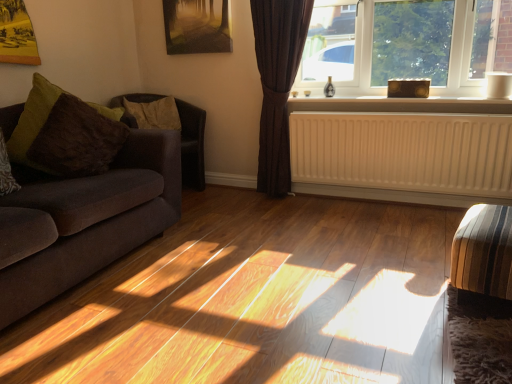
The width and height of the screenshot is (512, 384). In order to click on wooden floor at center in this screenshot , I will do (256, 300).

Is wooden textured picture frame at upper center not inside matte brown window at upper right?

Indeed, wooden textured picture frame at upper center is completely outside matte brown window at upper right.

Can you see wooden textured picture frame at upper center touching matte brown window at upper right?

No, wooden textured picture frame at upper center is not touching matte brown window at upper right.

Is wooden textured picture frame at upper center turned away from matte brown window at upper right?

No.

Is the depth of wooden textured picture frame at upper center greater than that of brown textured curtain at upper right?

Yes, wooden textured picture frame at upper center is further from the camera.

Where is `curtain lying below the wooden textured picture frame at upper center (from the image's perspective)`? This screenshot has height=384, width=512. curtain lying below the wooden textured picture frame at upper center (from the image's perspective) is located at coordinates (277, 83).

Looking at their sizes, would you say wooden textured picture frame at upper center is wider or thinner than brown textured curtain at upper right?

Clearly, wooden textured picture frame at upper center has less width compared to brown textured curtain at upper right.

Considering the sizes of objects striped fabric armchair at lower right, the second armchair from the back, and white painted wood at upper center in the image provided, who is smaller, striped fabric armchair at lower right, the second armchair from the back, or white painted wood at upper center?

white painted wood at upper center is smaller.

Is striped fabric armchair at lower right, the 1th armchair positioned from the front, far away from white painted wood at upper center?

Yes, striped fabric armchair at lower right, the 1th armchair positioned from the front, and white painted wood at upper center are located far from each other.

Which is closer to the camera, (490, 254) or (333, 100)?

Point (490, 254) is closer to the camera than point (333, 100).

Could white painted wood at upper center be considered to be inside striped fabric armchair at lower right, the second armchair from the back?

Definitely not — white painted wood at upper center is not inside striped fabric armchair at lower right, the second armchair from the back.

Is brown fuzzy pillow at left, which ranks as the first pillow in front-to-back order, further to the viewer compared to striped fabric armchair at lower right, the 1th armchair positioned from the front?

Yes, brown fuzzy pillow at left, which ranks as the first pillow in front-to-back order, is further from the viewer.

From a real-world perspective, who is located lower, brown fuzzy pillow at left, which ranks as the first pillow in front-to-back order, or striped fabric armchair at lower right, which is the second armchair in top-to-bottom order?

striped fabric armchair at lower right, which is the second armchair in top-to-bottom order, is physically lower.

Which point is more distant from viewer, (64,172) or (451,255)?

Point (64,172)

Considering the relative sizes of matte brown window at upper right and striped fabric armchair at lower right, the second armchair from the back, in the image provided, is matte brown window at upper right thinner than striped fabric armchair at lower right, the second armchair from the back,?

Correct, the width of matte brown window at upper right is less than that of striped fabric armchair at lower right, the second armchair from the back.

From a real-world perspective, who is located lower, matte brown window at upper right or striped fabric armchair at lower right, the second armchair from the back?

From a 3D spatial view, striped fabric armchair at lower right, the second armchair from the back, is below.

Does matte brown window at upper right have a lesser height compared to striped fabric armchair at lower right, which is the second armchair in top-to-bottom order?

No.

From the image's perspective, is white matte radiator at lower center located above or below velvet dark brown couch at left?

Clearly, from the image's perspective, white matte radiator at lower center is above velvet dark brown couch at left.

Find the location of `radiator to the right of velvet dark brown couch at left`. radiator to the right of velvet dark brown couch at left is located at coordinates (404, 151).

In terms of height, does white matte radiator at lower center look taller or shorter compared to velvet dark brown couch at left?

In the image, white matte radiator at lower center appears to be shorter than velvet dark brown couch at left.

Is white matte radiator at lower center further to the viewer compared to velvet dark brown couch at left?

Yes, white matte radiator at lower center is behind velvet dark brown couch at left.

Is brown leather armchair at left, which appears as the 2th armchair when viewed from the right, not close to matte brown window at upper right?

Indeed, brown leather armchair at left, which appears as the 2th armchair when viewed from the right, is not near matte brown window at upper right.

Between brown leather armchair at left, which appears as the 2th armchair when viewed from the right, and matte brown window at upper right, which one has more height?

brown leather armchair at left, which appears as the 2th armchair when viewed from the right.

From the picture: Considering the relative sizes of brown leather armchair at left, marked as the second armchair in a bottom-to-top arrangement, and matte brown window at upper right in the image provided, is brown leather armchair at left, marked as the second armchair in a bottom-to-top arrangement, bigger than matte brown window at upper right?

Correct, brown leather armchair at left, marked as the second armchair in a bottom-to-top arrangement, is larger in size than matte brown window at upper right.

Considering the sizes of brown leather armchair at left, which ranks as the 1th armchair in back-to-front order, and matte brown window at upper right in the image, is brown leather armchair at left, which ranks as the 1th armchair in back-to-front order, wider or thinner than matte brown window at upper right?

brown leather armchair at left, which ranks as the 1th armchair in back-to-front order, is wider than matte brown window at upper right.

Identify the location of picture frame on the left side of matte brown window at upper right. (196, 27).

You are a GUI agent. You are given a task and a screenshot of the screen. Output one action in this format:
    pyautogui.click(x=<x>, y=<y>)
    Task: Click on the curtain in front of the wooden textured picture frame at upper center
    The width and height of the screenshot is (512, 384).
    Given the screenshot: What is the action you would take?
    [277, 83]

Estimate the real-world distances between objects in this image. Which object is further from velvet dark brown couch at left, striped fabric armchair at lower right, placed as the 2th armchair when sorted from left to right, or white matte radiator at lower center?

striped fabric armchair at lower right, placed as the 2th armchair when sorted from left to right, is positioned further to the anchor velvet dark brown couch at left.

From the image, which object appears to be farther from brown textured curtain at upper right, matte brown window at upper right or white painted wood at upper center?

matte brown window at upper right.

Based on their spatial positions, is brown textured curtain at upper right or brown fuzzy pillow at left, which ranks as the first pillow in front-to-back order, closer to striped fabric armchair at lower right, placed as the 2th armchair when sorted from left to right?

brown textured curtain at upper right.

Looking at the image, which one is located further to wooden textured picture frame at upper center, velvet dark brown couch at left or brown textured curtain at upper right?

velvet dark brown couch at left is positioned further to the anchor wooden textured picture frame at upper center.

When comparing their distances from matte brown window at upper right, does white painted wood at upper center or brown textured pillow at left, positioned as the 1th pillow in back-to-front order, seem further?

brown textured pillow at left, positioned as the 1th pillow in back-to-front order.

Which object lies further to the anchor point brown fuzzy pillow at left, which is counted as the 2th pillow, starting from the back, matte brown window at upper right or brown textured curtain at upper right?

Based on the image, matte brown window at upper right appears to be further to brown fuzzy pillow at left, which is counted as the 2th pillow, starting from the back.

When comparing their distances from velvet dark brown couch at left, does brown leather armchair at left, marked as the second armchair in a bottom-to-top arrangement, or brown fuzzy pillow at left, which is counted as the 2th pillow, starting from the back, seem closer?

brown fuzzy pillow at left, which is counted as the 2th pillow, starting from the back, is closer to velvet dark brown couch at left.

Based on their spatial positions, is brown textured curtain at upper right or white matte radiator at lower center further from wooden textured picture frame at upper center?

The object further to wooden textured picture frame at upper center is white matte radiator at lower center.

You are a GUI agent. You are given a task and a screenshot of the screen. Output one action in this format:
    pyautogui.click(x=<x>, y=<y>)
    Task: Click on the curtain positioned between striped fabric armchair at lower right, acting as the 1th armchair starting from the bottom, and wooden textured picture frame at upper center from near to far
    
    Given the screenshot: What is the action you would take?
    pyautogui.click(x=277, y=83)

Where is `window located between brown fuzzy pillow at left, which is counted as the 2th pillow, starting from the back, and striped fabric armchair at lower right, acting as the 1th armchair starting from the bottom, in the left-right direction`? window located between brown fuzzy pillow at left, which is counted as the 2th pillow, starting from the back, and striped fabric armchair at lower right, acting as the 1th armchair starting from the bottom, in the left-right direction is located at coordinates (406, 44).

Where is `curtain located between wooden floor at center and wooden textured picture frame at upper center in the depth direction`? curtain located between wooden floor at center and wooden textured picture frame at upper center in the depth direction is located at coordinates (277, 83).

Locate an element on the screen. The height and width of the screenshot is (384, 512). radiator positioned between wooden floor at center and white painted wood at upper center from near to far is located at coordinates (404, 151).